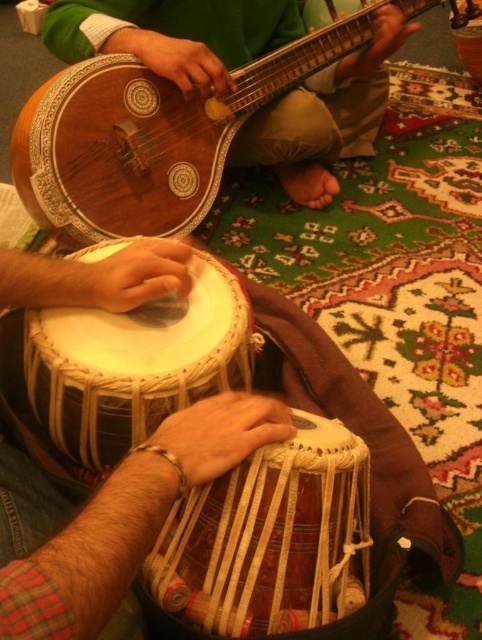
You are a musician who wants to place a 12 inch wide music book between the wooden guitar at upper left and the white woven drum at center. Is there enough space?

The distance between the wooden guitar at upper left and the white woven drum at center is 16.93 inches, so yes, the 12 inch wide music book can fit between them.

You are a musician who wants to place both the wooden guitar at upper left and the white woven drum at center on a shelf. The shelf has enough space for only one of them. Which object should you choose to fit on the shelf?

The wooden guitar at upper left is bigger than the white woven drum at center, so the white woven drum at center will fit on the shelf.